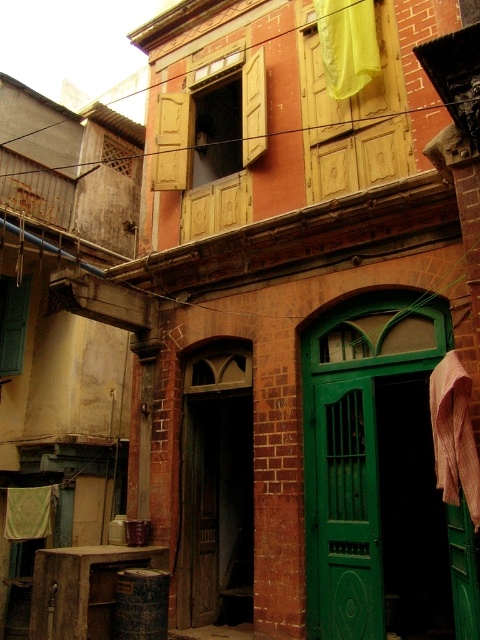
Question: Can you confirm if green wooden door at center is bigger than yellow fabric at upper center?

Choices:
 (A) no
 (B) yes

Answer: (B)

Question: Can you confirm if green wooden door at center is positioned to the left of yellow fabric at upper center?

Choices:
 (A) no
 (B) yes

Answer: (B)

Question: Can you confirm if brown textured cloth at right is bigger than yellow fabric at upper center?

Choices:
 (A) yes
 (B) no

Answer: (B)

Question: Which of the following is the farthest from the observer?

Choices:
 (A) (356, 42)
 (B) (360, 433)
 (C) (199, 625)

Answer: (C)

Question: Which point appears closest to the camera in this image?

Choices:
 (A) (325, 48)
 (B) (336, 540)

Answer: (B)

Question: Which object is the closest to the brown textured cloth at right?

Choices:
 (A) green wooden door at center
 (B) yellow fabric at upper center

Answer: (A)